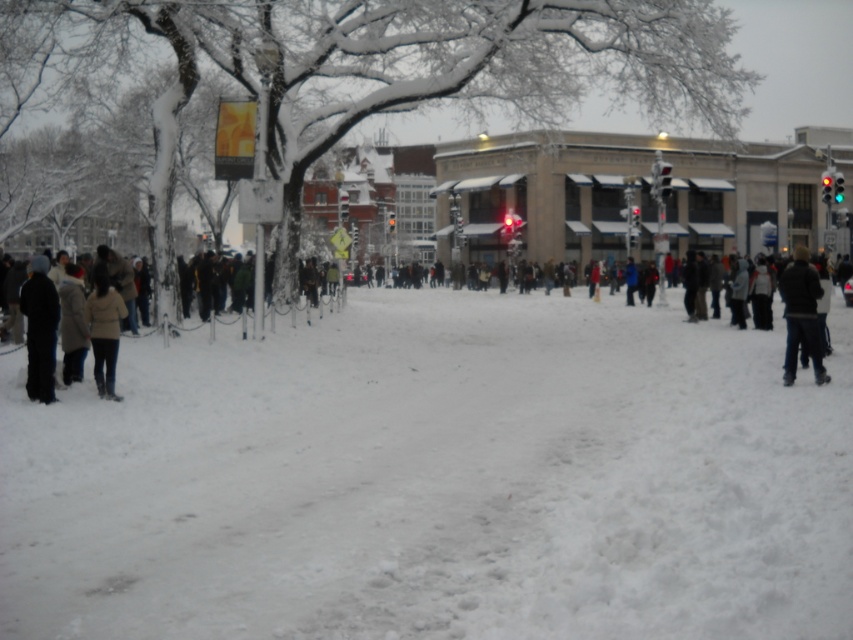
You are a photographer standing in the snowy urban scene. You want to capture a wide shot that includes both the white fluffy snow at center and the black matte coat at left. Which object should you focus on to ensure both are in frame without zooming in or out?

You should focus on the white fluffy snow at center because its width surpasses the black matte coat at left, making it the wider object. By centering the shot on the wider snow area, both objects will fit within the frame without needing to adjust the zoom.

You are standing in the snowy urban scene and want to walk from the black matte coat at left to the white fluffy snow at center. Which direction should you head?

You should head to the right to reach the white fluffy snow at center from the black matte coat at left since the white fluffy snow at center is to the right of the black matte coat at left.

You are a fashion stylist observing two coats displayed on mannequins in a snowy street scene. The coats are the dark gray coat at left and the black matte coat at left. Which coat is shorter in height?

The dark gray coat at left has a lesser height compared to the black matte coat at left, so the dark gray coat at left is shorter.